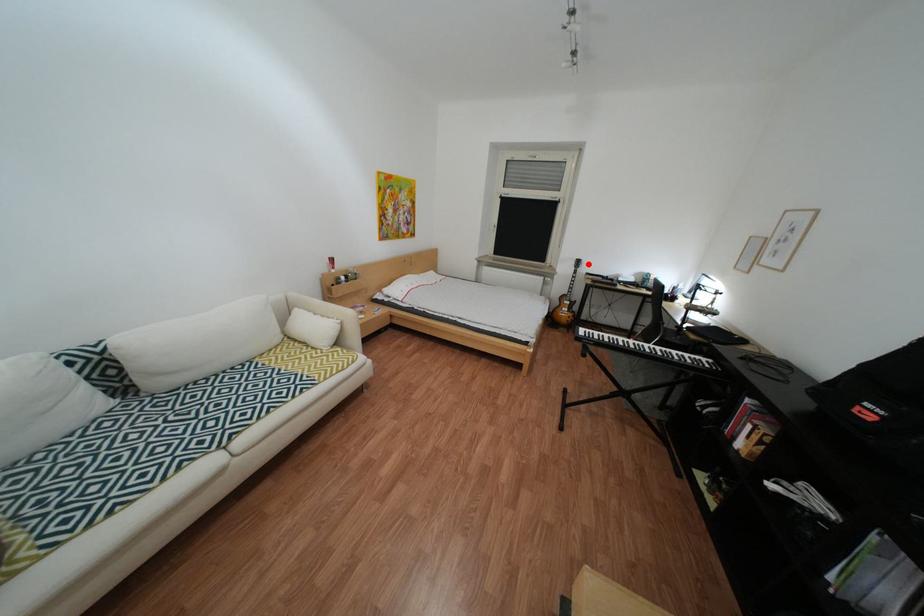
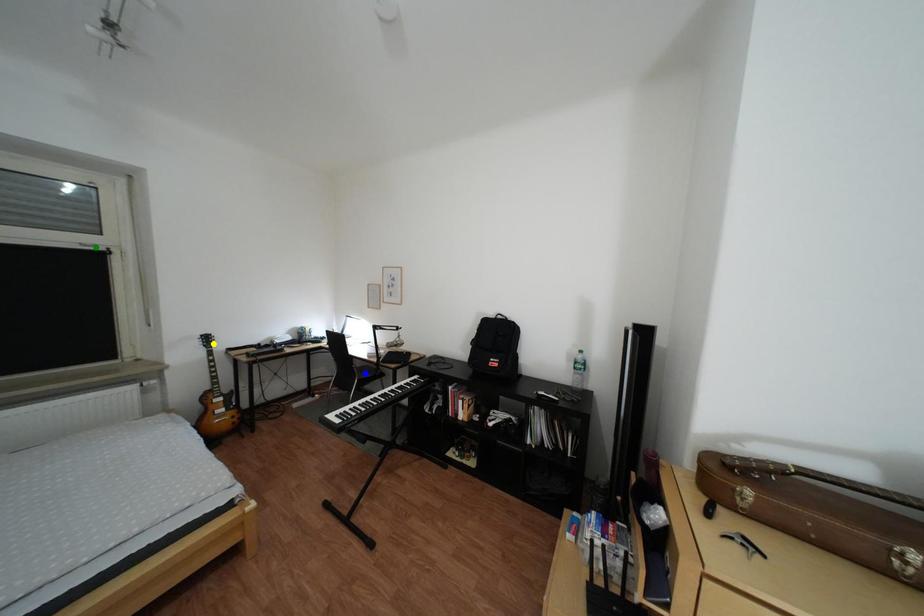
Question: I am providing you with two images of the same scene from different viewpoints. A red point is marked on the first image. You are given multiple points on the second image. Which mark in image 2 goes with the point in image 1?

Choices:
 (A) blue point
 (B) yellow point
 (C) green point

Answer: (B)